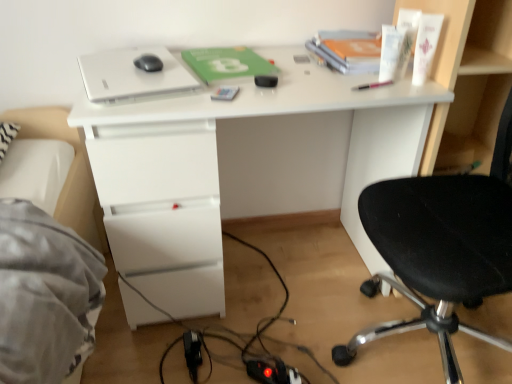
Identify the location of vacant space positioned to the left of black matte mouse at upper center. The image size is (512, 384). (105, 65).